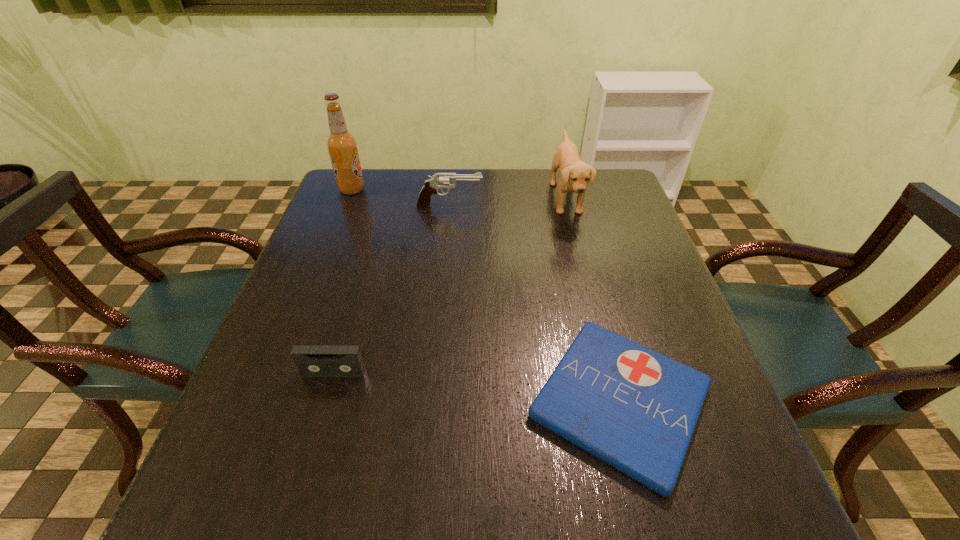
Where is `videotape that is at the left edge`? videotape that is at the left edge is located at coordinates (311, 360).

This screenshot has height=540, width=960. I want to click on puppy at the right edge, so click(574, 174).

You are a GUI agent. You are given a task and a screenshot of the screen. Output one action in this format:
    pyautogui.click(x=<x>, y=<y>)
    Task: Click on the first-aid kit at the right edge
    The width and height of the screenshot is (960, 540).
    Given the screenshot: What is the action you would take?
    pyautogui.click(x=636, y=409)

This screenshot has width=960, height=540. Find the location of `object that is positioned at the far left corner`. object that is positioned at the far left corner is located at coordinates (342, 146).

Locate an element on the screen. This screenshot has height=540, width=960. object at the far right corner is located at coordinates (574, 174).

Locate an element on the screen. object that is at the near right corner is located at coordinates (636, 409).

Where is `vacant space at the far edge of the desktop`? This screenshot has height=540, width=960. vacant space at the far edge of the desktop is located at coordinates (x=534, y=172).

In the image, there is a desktop. Where is `free space at the near edge`? Image resolution: width=960 pixels, height=540 pixels. free space at the near edge is located at coordinates (486, 482).

Identify the location of vacant space at the left edge of the desktop. The width and height of the screenshot is (960, 540). (359, 279).

At what (x,y) coordinates should I click in order to perform the action: click on vacant area at the right edge of the desktop. Please return your answer as a coordinate pair (x, y). Looking at the image, I should click on (636, 217).